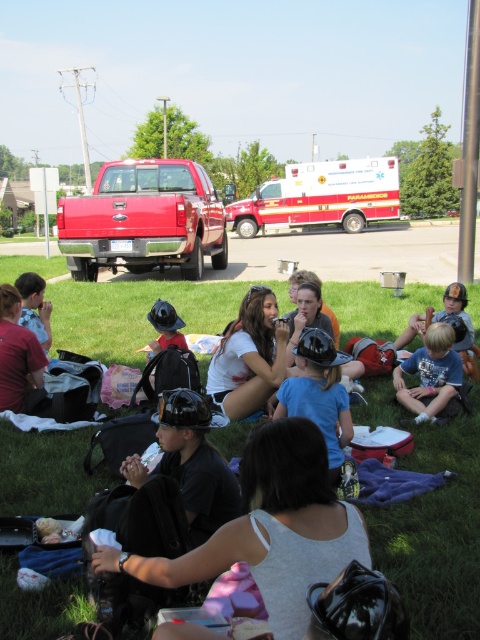
Question: Which point is closer to the camera?

Choices:
 (A) red matte pickup truck at center
 (B) blue cotton shirt at center
 (C) matte black helmet at center
 (D) white glossy ambulance at center

Answer: (B)

Question: Is black matte helmet at center behind white matte shirt at center?

Choices:
 (A) no
 (B) yes

Answer: (A)

Question: Does black matte helmet at center have a larger size compared to white glossy ambulance at center?

Choices:
 (A) no
 (B) yes

Answer: (A)

Question: Observing the image, what is the correct spatial positioning of black matte helmet at center in reference to white matte shirt at center?

Choices:
 (A) right
 (B) left

Answer: (B)

Question: Which object appears farthest from the camera in this image?

Choices:
 (A) blue cotton shirt at center
 (B) matte black helmet at center

Answer: (B)

Question: Which object is farther from the camera taking this photo?

Choices:
 (A) blue matte helmet at center
 (B) matte black helmet at center
 (C) red matte pickup truck at center
 (D) black matte helmet at center

Answer: (C)